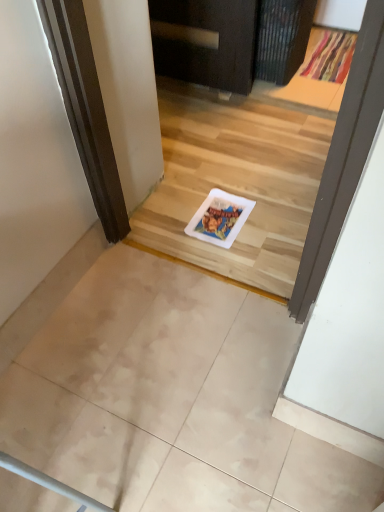
Question: Visually, is textured fabric doormat at upper right positioned to the left or to the right of matte beige tile at lower left?

Choices:
 (A) right
 (B) left

Answer: (A)

Question: From the image's perspective, is textured fabric doormat at upper right above or below matte beige tile at lower left?

Choices:
 (A) below
 (B) above

Answer: (B)

Question: Which is correct: textured fabric doormat at upper right is inside matte beige tile at lower left, or outside of it?

Choices:
 (A) inside
 (B) outside

Answer: (B)

Question: Does point (19, 371) appear closer or farther from the camera than point (327, 52)?

Choices:
 (A) farther
 (B) closer

Answer: (B)

Question: In the image, is matte beige tile at lower left positioned in front of or behind textured fabric doormat at upper right?

Choices:
 (A) behind
 (B) front

Answer: (B)

Question: Looking at their shapes, would you say matte beige tile at lower left is wider or thinner than textured fabric doormat at upper right?

Choices:
 (A) thin
 (B) wide

Answer: (A)

Question: Would you say matte beige tile at lower left is to the left or to the right of textured fabric doormat at upper right in the picture?

Choices:
 (A) right
 (B) left

Answer: (B)